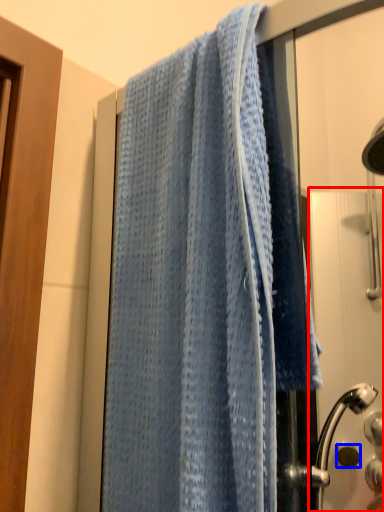
Question: Among these objects, which one is nearest to the camera, screen door (highlighted by a red box) or knob (highlighted by a blue box)?

Choices:
 (A) screen door
 (B) knob

Answer: (A)